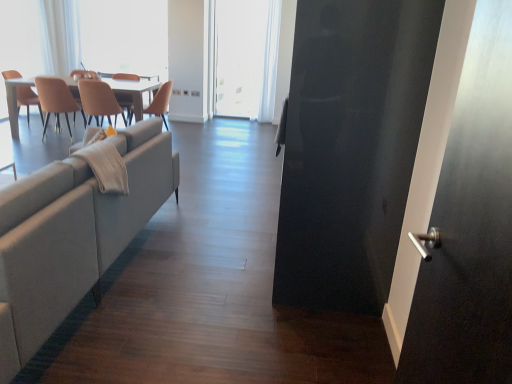
Question: Should I look upward or downward to see white matte window screen at center, which is counted as the first window screen, starting from the right?

Choices:
 (A) up
 (B) down

Answer: (A)

Question: Is light gray fabric couch at left not inside matte orange chair at left, the fourth chair in the right-to-left sequence?

Choices:
 (A) yes
 (B) no

Answer: (A)

Question: Is light gray fabric couch at left positioned before matte orange chair at left, which appears as the 1th chair when viewed from the left?

Choices:
 (A) no
 (B) yes

Answer: (B)

Question: Is light gray fabric couch at left directly adjacent to matte orange chair at left, which appears as the 1th chair when viewed from the left?

Choices:
 (A) yes
 (B) no

Answer: (B)

Question: Is light gray fabric couch at left smaller than matte orange chair at left, the fourth chair in the right-to-left sequence?

Choices:
 (A) no
 (B) yes

Answer: (A)

Question: Is the depth of light gray fabric couch at left greater than that of matte orange chair at left, which appears as the 1th chair when viewed from the left?

Choices:
 (A) no
 (B) yes

Answer: (A)

Question: Is light gray fabric couch at left oriented away from matte orange chair at left, the fourth chair in the right-to-left sequence?

Choices:
 (A) yes
 (B) no

Answer: (B)

Question: Considering the relative positions of matte beige chair at center, placed as the 2th chair when sorted from right to left, and beige leather chair at center, placed as the 1th chair when sorted from right to left, in the image provided, is matte beige chair at center, placed as the 2th chair when sorted from right to left, in front of beige leather chair at center, placed as the 1th chair when sorted from right to left,?

Choices:
 (A) yes
 (B) no

Answer: (A)

Question: Is matte beige chair at center, placed as the 2th chair when sorted from right to left, outside beige leather chair at center, which is the fourth chair from left to right?

Choices:
 (A) no
 (B) yes

Answer: (B)

Question: Is matte beige chair at center, placed as the 2th chair when sorted from right to left, taller than beige leather chair at center, placed as the 1th chair when sorted from right to left?

Choices:
 (A) yes
 (B) no

Answer: (B)

Question: From the image's perspective, would you say matte beige chair at center, which is the 3th chair from left to right, is shown under beige leather chair at center, which is the fourth chair from left to right?

Choices:
 (A) yes
 (B) no

Answer: (A)

Question: Is matte beige chair at center, placed as the 2th chair when sorted from right to left, facing towards beige leather chair at center, which is the fourth chair from left to right?

Choices:
 (A) yes
 (B) no

Answer: (B)

Question: Is beige leather chair at center, which is the fourth chair from left to right, inside matte beige chair at center, which is the 3th chair from left to right?

Choices:
 (A) yes
 (B) no

Answer: (B)

Question: Is white glossy table at upper left surrounding white sheer curtain at upper center?

Choices:
 (A) no
 (B) yes

Answer: (A)